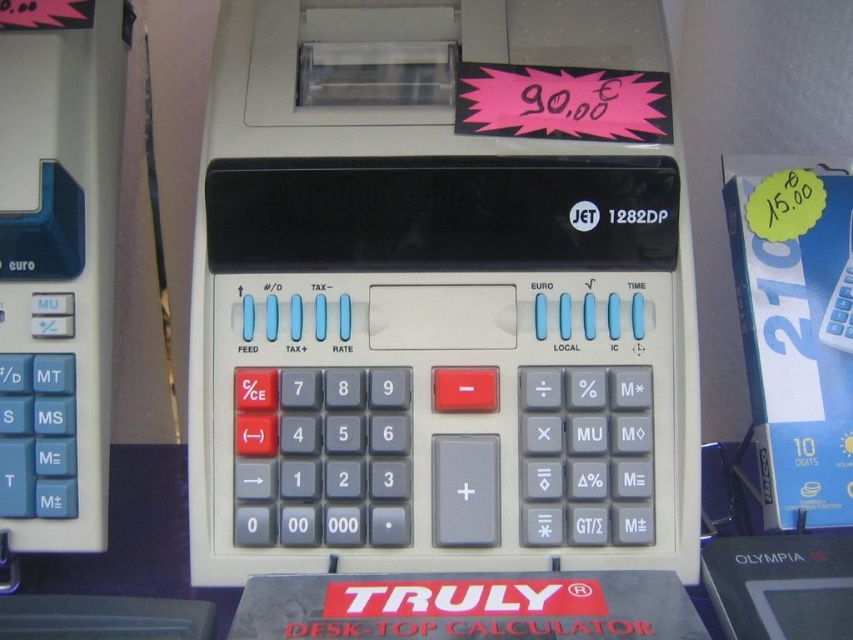
You are trying to locate the beige plastic calculator at center in the vintage cash register model labeled

The beige plastic calculator at center is positioned at the center of the cash register, specifically at coordinates point (437, 301).

You are holding a 12 inch ruler and want to measure the distance between you and the point at coordinates point [674,289]. According to the scene, how many rulers would you need to reach that point?

The point point [674,289] is 36.79 inches away from the camera. Since each ruler is 12 inches, you would need approximately 3 rulers to cover the distance.

You are a cashier who needs to use the calculator. There are two calculators in front of you, a beige plastic calculator at center and a white plastic calculator at center. Which one is located above the other?

The beige plastic calculator at center is positioned over the white plastic calculator at center.